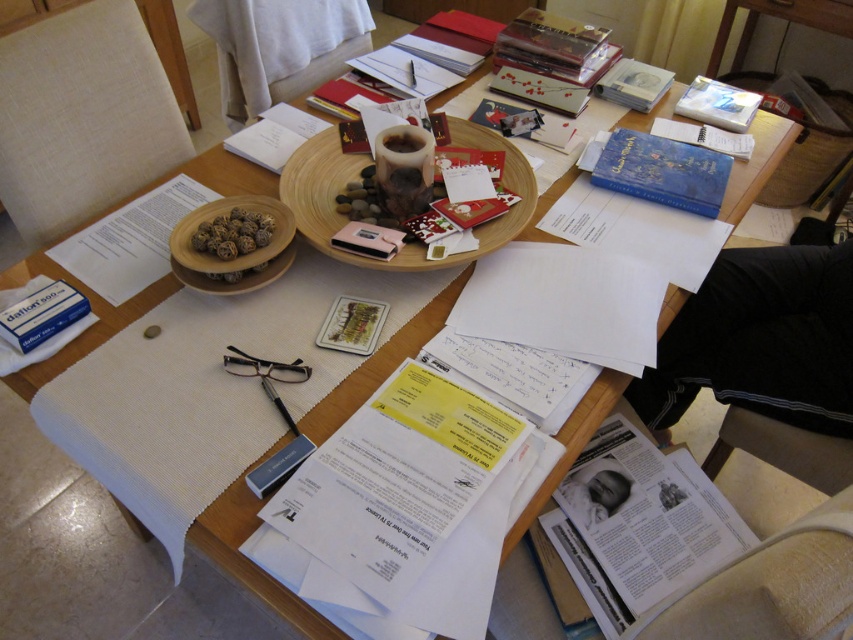
Question: Can you confirm if blue matte book at upper right is positioned below red matte card at center?

Choices:
 (A) yes
 (B) no

Answer: (B)

Question: Is white paper at center to the right of red matte card at center from the viewer's perspective?

Choices:
 (A) yes
 (B) no

Answer: (A)

Question: Among these objects, which one is nearest to the camera?

Choices:
 (A) white paper at center
 (B) blue hardcover book at upper right
 (C) wooden bowl at center

Answer: (A)

Question: Does wooden tray at center have a lesser width compared to blue hardcover book at upper right?

Choices:
 (A) yes
 (B) no

Answer: (B)

Question: Which object appears closest to the camera in this image?

Choices:
 (A) white matte box at lower left
 (B) matte paper book at center
 (C) white paper magazine at lower right
 (D) white matte book at upper right

Answer: (C)

Question: Which point is farther from the camera taking this photo?

Choices:
 (A) (383, 237)
 (B) (465, 218)
 (C) (631, 372)
 (D) (605, 74)

Answer: (D)